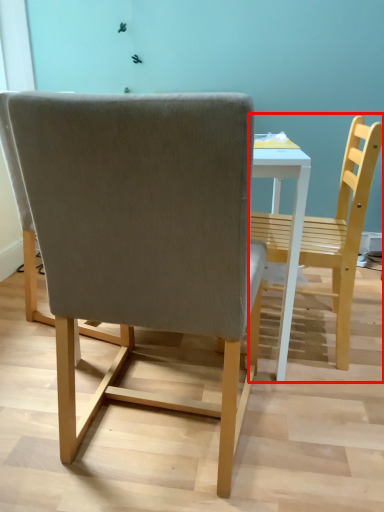
Question: From the image's perspective, considering the relative positions of chair (annotated by the red box) and chair in the image provided, where is chair (annotated by the red box) located with respect to the staircase?

Choices:
 (A) above
 (B) below

Answer: (A)